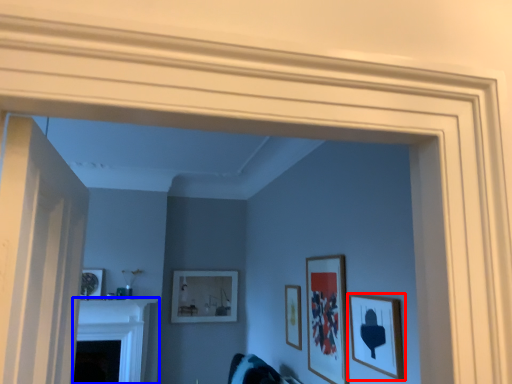
Question: Which point is closer to the camera, picture frame (highlighted by a red box) or fireplace (highlighted by a blue box)?

Choices:
 (A) picture frame
 (B) fireplace

Answer: (A)